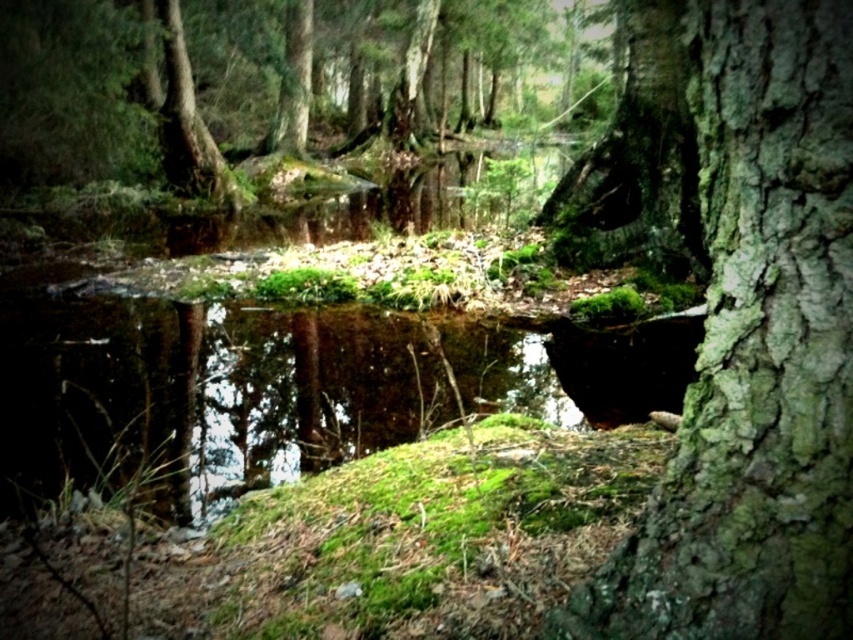
Who is shorter, green rough bark tree at center or green rough bark tree trunk at center?

green rough bark tree at center is shorter.

Is point (840, 324) positioned before point (659, 168)?

That is True.

The height and width of the screenshot is (640, 853). Describe the element at coordinates (756, 352) in the screenshot. I see `green rough bark tree at center` at that location.

Locate an element on the screen. The image size is (853, 640). green rough bark tree at center is located at coordinates (756, 352).

Can you confirm if green rough bark tree trunk at center is positioned to the right of green mossy bark tree trunk at upper left?

Yes, green rough bark tree trunk at center is to the right of green mossy bark tree trunk at upper left.

Who is shorter, green rough bark tree trunk at center or green mossy bark tree trunk at upper left?

green rough bark tree trunk at center

Who is more distant from viewer, (639, 8) or (184, 74)?

Point (184, 74)

Locate an element on the screen. green rough bark tree trunk at center is located at coordinates (637, 160).

Which is in front, point (706, 608) or point (144, 88)?

Point (706, 608) is in front.

Measure the distance between green rough bark tree at center and green mossy bark tree trunk at upper left.

They are 19.08 meters apart.

Is point (691, 36) less distant than point (167, 118)?

Yes, it is in front of point (167, 118).

You are a GUI agent. You are given a task and a screenshot of the screen. Output one action in this format:
    pyautogui.click(x=<x>, y=<y>)
    Task: Click on the green rough bark tree at center
    Image resolution: width=853 pixels, height=640 pixels.
    Given the screenshot: What is the action you would take?
    (x=756, y=352)